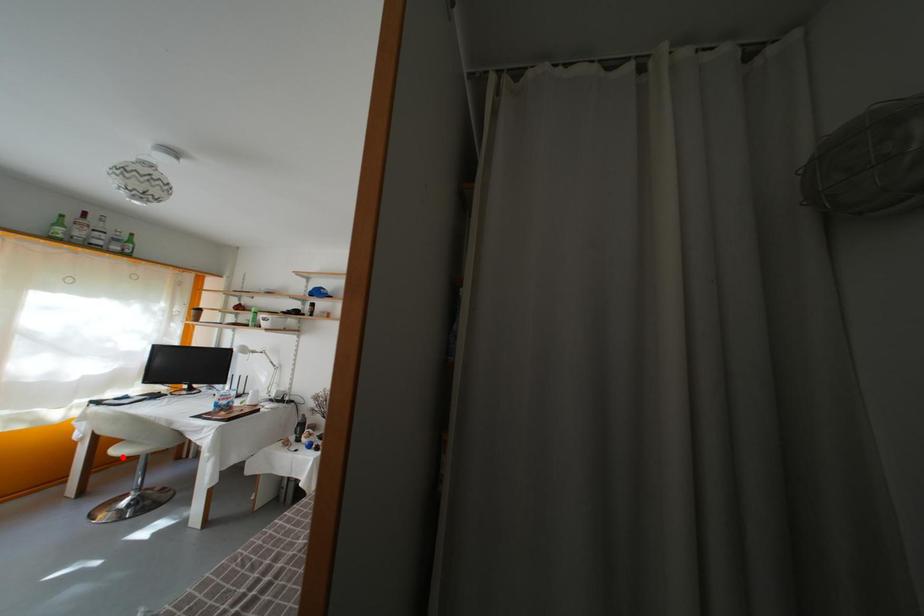
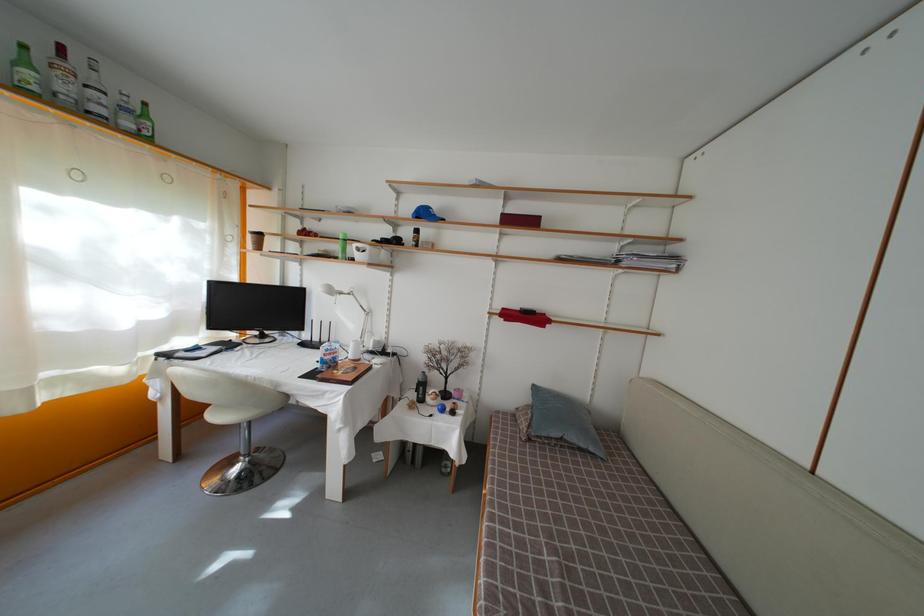
Where in the second image is the point corresponding to the highlighted location from the first image?

(221, 422)